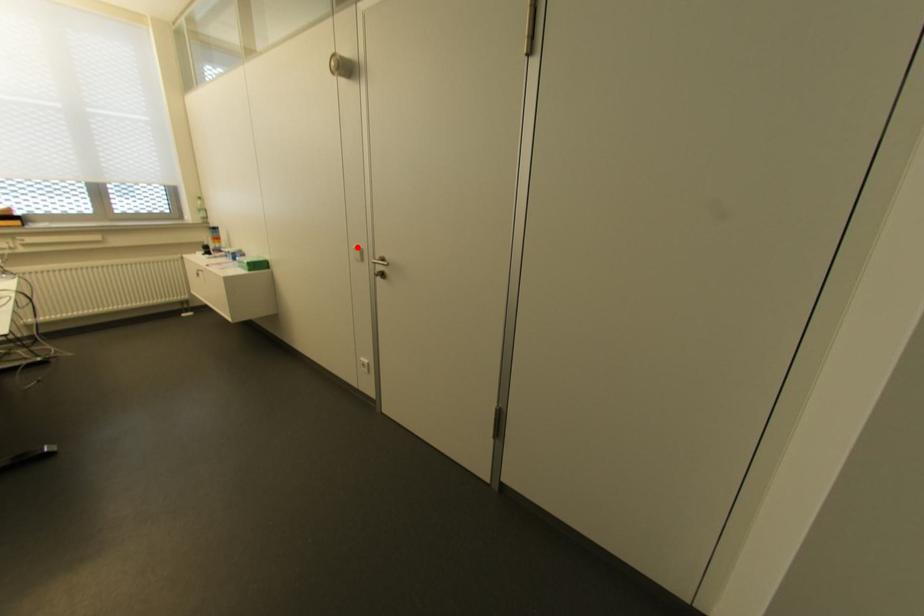
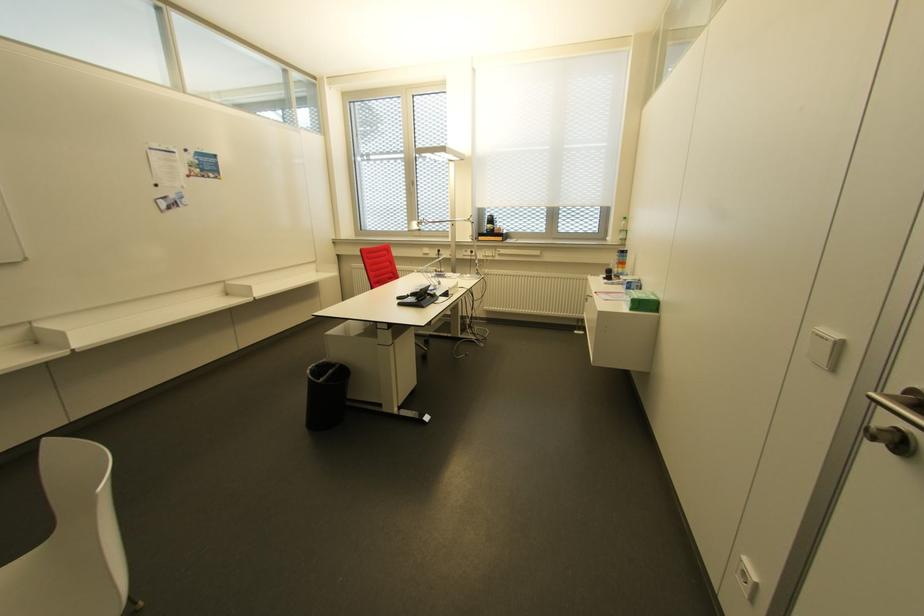
In the second image, find the point that corresponds to the highlighted location in the first image.

(833, 334)